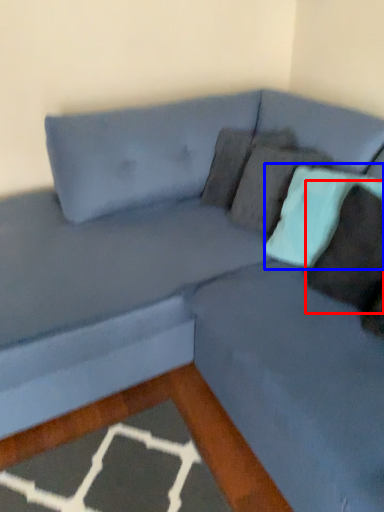
Question: Among these objects, which one is farthest to the camera, pillow (highlighted by a red box) or pillow (highlighted by a blue box)?

Choices:
 (A) pillow
 (B) pillow

Answer: (B)